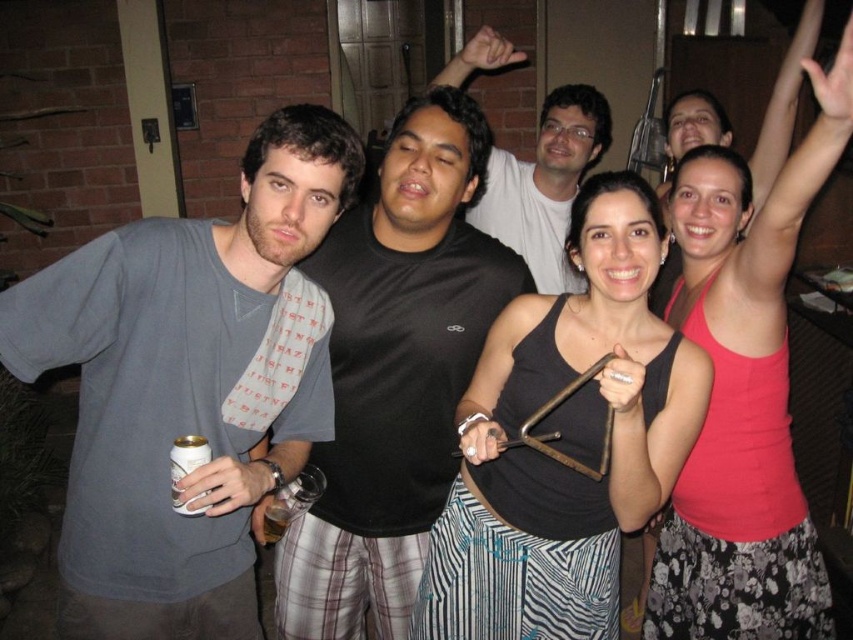
You are taking a photo of the group and want to focus on both point (579, 269) and point (178, 497). Which point is closer to the camera?

Point (178, 497) is closer to the camera than point (579, 269).

You are a photographer trying to capture the group photo. You notice the black matte tank top at center and the silver metallic can at lower left. Which object should you focus on first if you want to ensure both are in focus, considering their sizes?

The black matte tank top at center might be wider than silver metallic can at lower left, so focusing on the larger object first would help ensure both are in focus.